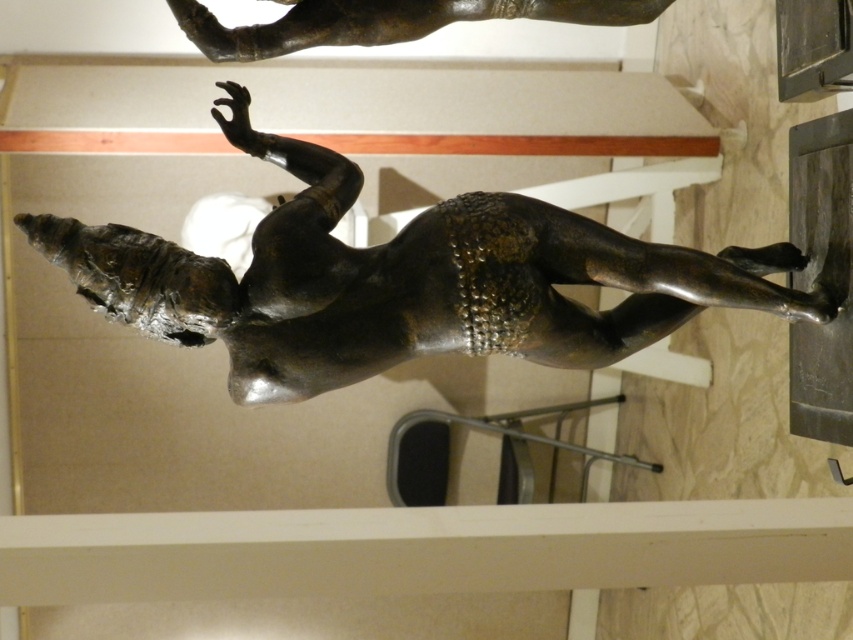
Locate an element on the screen. This screenshot has height=640, width=853. bronze statue at center is located at coordinates (403, 280).

Can you confirm if bronze statue at center is bigger than shiny bronze statue at upper center?

Indeed, bronze statue at center has a larger size compared to shiny bronze statue at upper center.

Is point (608, 257) behind point (426, 28)?

No, (608, 257) is in front of (426, 28).

Identify the location of bronze statue at center. Image resolution: width=853 pixels, height=640 pixels. (403, 280).